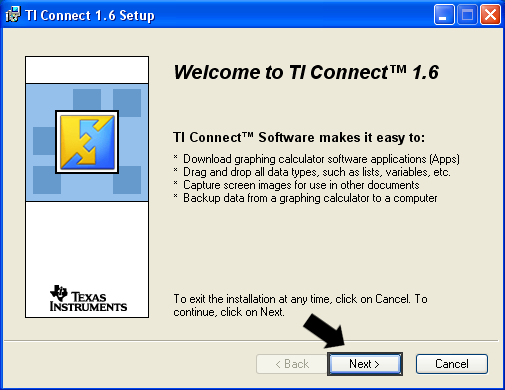
You are a GUI agent. You are given a task and a screenshot of the screen. Output one action in this format:
    pyautogui.click(x=<x>, y=<y>)
    Task: Click on the grey colored interior background of box
    This screenshot has width=505, height=390.
    Given the screenshot: What is the action you would take?
    pyautogui.click(x=314, y=235)